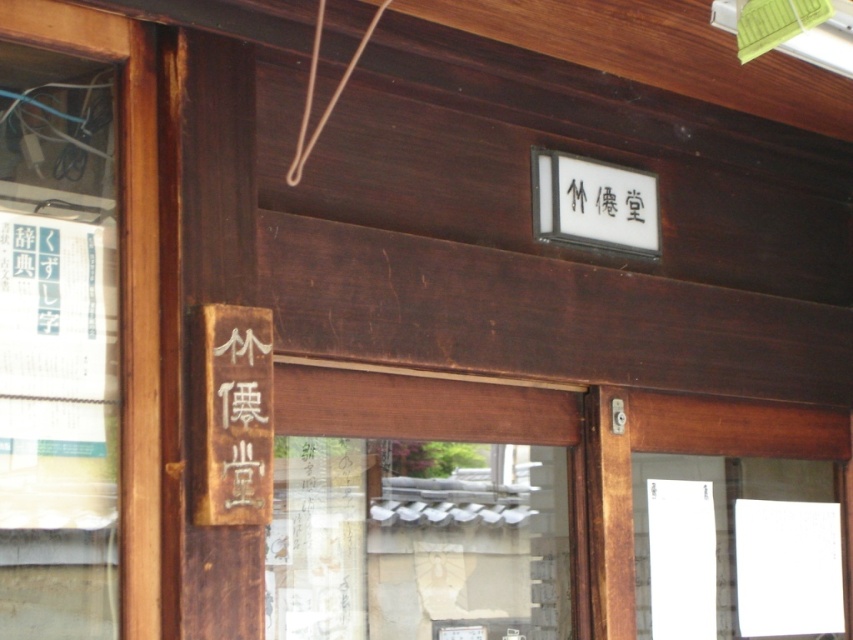
Question: Which object is positioned closest to the wooden sign at left?

Choices:
 (A) wooden door at center
 (B) black wood sign at upper center

Answer: (B)

Question: Does wooden door at center come behind wooden sign at left?

Choices:
 (A) no
 (B) yes

Answer: (B)

Question: Does wooden door at center lie in front of black wood sign at upper center?

Choices:
 (A) no
 (B) yes

Answer: (B)

Question: Does wooden sign at left appear under black wood sign at upper center?

Choices:
 (A) no
 (B) yes

Answer: (B)

Question: Which point is closer to the camera?

Choices:
 (A) black wood sign at upper center
 (B) wooden door at center

Answer: (B)

Question: Estimate the real-world distances between objects in this image. Which object is farther from the black wood sign at upper center?

Choices:
 (A) wooden sign at left
 (B) wooden door at center

Answer: (A)